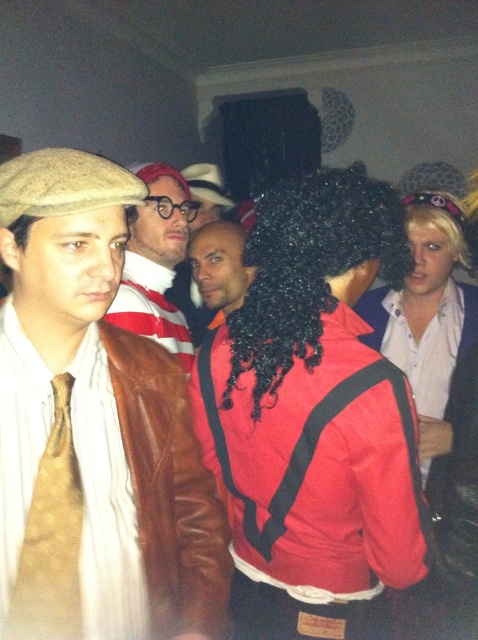
Which of these two, gold textured tie at left or satin black wig at center, stands shorter?

gold textured tie at left is shorter.

Who is lower down, gold textured tie at left or satin black wig at center?

Positioned lower is gold textured tie at left.

Which is in front, point (42, 538) or point (221, 301)?

Point (42, 538)

The height and width of the screenshot is (640, 478). I want to click on gold textured tie at left, so click(51, 538).

Does matte white shirt at center appear on the right side of gold textured tie at left?

Correct, you'll find matte white shirt at center to the right of gold textured tie at left.

Measure the distance between point (x=434, y=378) and camera.

Point (x=434, y=378) and camera are 5.44 feet apart from each other.

Locate an element on the screen. The image size is (478, 640). matte white shirt at center is located at coordinates [x=426, y=316].

Can you confirm if striped wool sweater at center is wider than satin black wig at center?

No, striped wool sweater at center is not wider than satin black wig at center.

Does striped wool sweater at center appear over satin black wig at center?

Yes.

Is point (151, 225) farther from viewer compared to point (221, 227)?

No, it is not.

Find the location of a particular element. striped wool sweater at center is located at coordinates (155, 262).